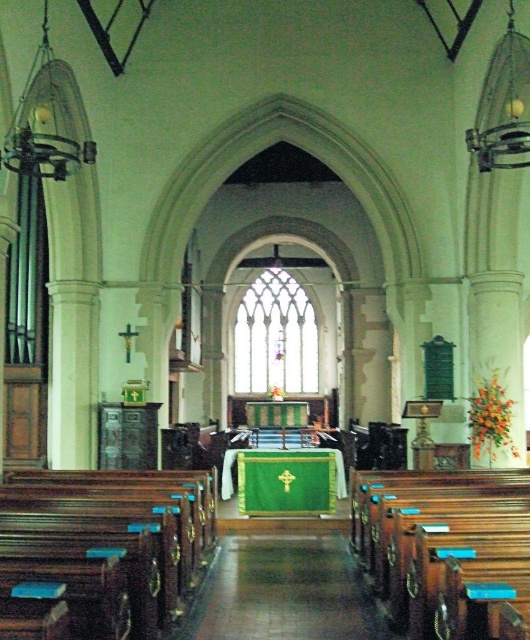
Question: Which point is closer to the camera taking this photo?

Choices:
 (A) [320, 637]
 (B) [493, 547]

Answer: (B)

Question: Is wooden polished pews at lower right smaller than shiny polished wood aisle at center?

Choices:
 (A) yes
 (B) no

Answer: (B)

Question: Is wooden polished pews at lower right closer to camera compared to shiny polished wood aisle at center?

Choices:
 (A) yes
 (B) no

Answer: (A)

Question: Which object appears farthest from the camera in this image?

Choices:
 (A) shiny polished wood aisle at center
 (B) polished dark wood pews at left

Answer: (A)

Question: Which point is farther to the camera?

Choices:
 (A) shiny polished wood aisle at center
 (B) polished dark wood pews at left

Answer: (A)

Question: Can you confirm if polished dark wood pews at left is thinner than shiny polished wood aisle at center?

Choices:
 (A) yes
 (B) no

Answer: (B)